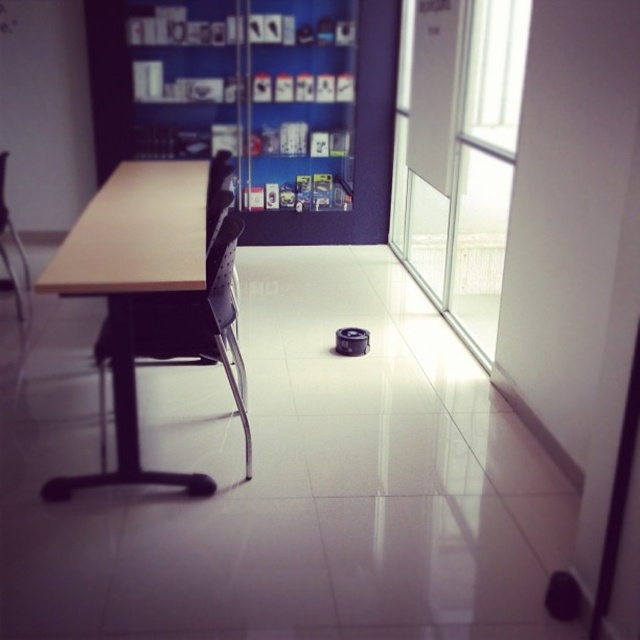
Is point (72, 488) positioned in front of point (6, 259)?

That is True.

Who is lower down, light brown wood table at center or matte plastic chair at left?

light brown wood table at center

Locate an element on the screen. Image resolution: width=640 pixels, height=640 pixels. light brown wood table at center is located at coordinates (132, 285).

The image size is (640, 640). What are the coordinates of `light brown wood table at center` in the screenshot? It's located at (132, 285).